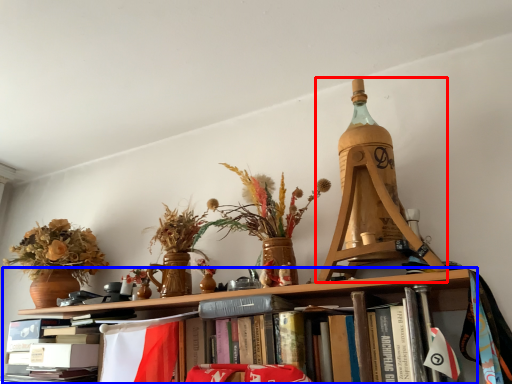
Question: Which point is closer to the camera, Eiffel tower (highlighted by a red box) or shelf (highlighted by a blue box)?

Choices:
 (A) Eiffel tower
 (B) shelf

Answer: (B)